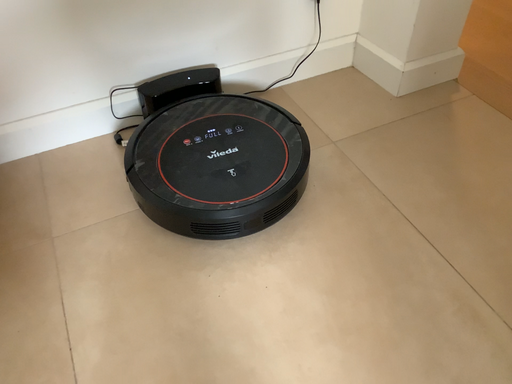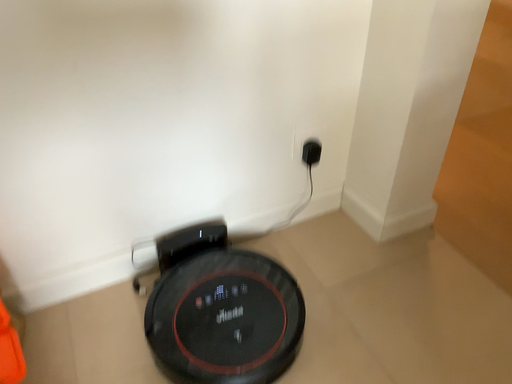
Question: Which way did the camera rotate in the video?

Choices:
 (A) rotated downward
 (B) rotated upward

Answer: (B)